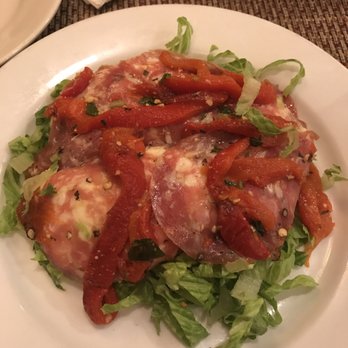
The height and width of the screenshot is (348, 348). In order to click on table in this screenshot , I will do `click(338, 21)`.